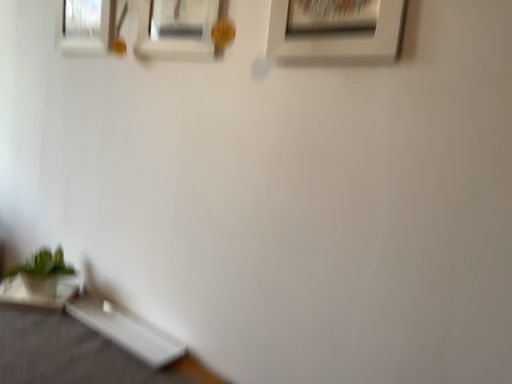
Question: Does white glossy table at lower left, the 1th table from the left, have a greater height compared to white glossy table at lower left, the 1th table positioned from the right?

Choices:
 (A) no
 (B) yes

Answer: (B)

Question: Are white glossy table at lower left, which ranks as the 2th table in right-to-left order, and white glossy table at lower left, which appears as the second table when viewed from the left, beside each other?

Choices:
 (A) yes
 (B) no

Answer: (B)

Question: Is white glossy table at lower left, the 1th table from the left, looking in the opposite direction of white glossy table at lower left, the 1th table positioned from the right?

Choices:
 (A) no
 (B) yes

Answer: (A)

Question: From the image's perspective, is white glossy table at lower left, which ranks as the 2th table in right-to-left order, located beneath white glossy table at lower left, the 1th table positioned from the right?

Choices:
 (A) no
 (B) yes

Answer: (A)

Question: From a real-world perspective, does white glossy table at lower left, which ranks as the 2th table in right-to-left order, sit lower than white glossy table at lower left, the 1th table positioned from the right?

Choices:
 (A) yes
 (B) no

Answer: (B)

Question: In the image, is white glossy table at lower left, which appears as the second table when viewed from the left, positioned in front of or behind green matte plant at lower left?

Choices:
 (A) front
 (B) behind

Answer: (A)

Question: Is white glossy table at lower left, the 1th table positioned from the right, inside the boundaries of green matte plant at lower left, or outside?

Choices:
 (A) outside
 (B) inside

Answer: (A)

Question: Considering the positions of white glossy table at lower left, the 1th table positioned from the right, and green matte plant at lower left in the image, is white glossy table at lower left, the 1th table positioned from the right, wider or thinner than green matte plant at lower left?

Choices:
 (A) wide
 (B) thin

Answer: (B)

Question: From their relative heights in the image, would you say white glossy table at lower left, the 1th table positioned from the right, is taller or shorter than green matte plant at lower left?

Choices:
 (A) tall
 (B) short

Answer: (B)

Question: Relative to white matte picture frame at upper center, marked as the 1th picture frame in a right-to-left arrangement, is matte glass picture frame at upper left, positioned as the first picture frame in left-to-right order, in front or behind?

Choices:
 (A) behind
 (B) front

Answer: (A)

Question: From the image's perspective, relative to white matte picture frame at upper center, marked as the third picture frame in a left-to-right arrangement, is matte glass picture frame at upper left, the third picture frame in the front-to-back sequence, above or below?

Choices:
 (A) below
 (B) above

Answer: (B)

Question: Would you say matte glass picture frame at upper left, placed as the 1th picture frame when sorted from back to front, is inside or outside white matte picture frame at upper center, marked as the third picture frame in a left-to-right arrangement?

Choices:
 (A) inside
 (B) outside

Answer: (B)

Question: Would you say matte glass picture frame at upper left, placed as the 1th picture frame when sorted from back to front, is to the left or to the right of white matte picture frame at upper center, acting as the first picture frame starting from the front, in the picture?

Choices:
 (A) right
 (B) left

Answer: (B)

Question: Would you say green matte plant at lower left is inside or outside white glossy table at lower left, the 1th table positioned from the right?

Choices:
 (A) inside
 (B) outside

Answer: (B)

Question: From a real-world perspective, is green matte plant at lower left physically located above or below white glossy table at lower left, the 1th table positioned from the right?

Choices:
 (A) above
 (B) below

Answer: (A)